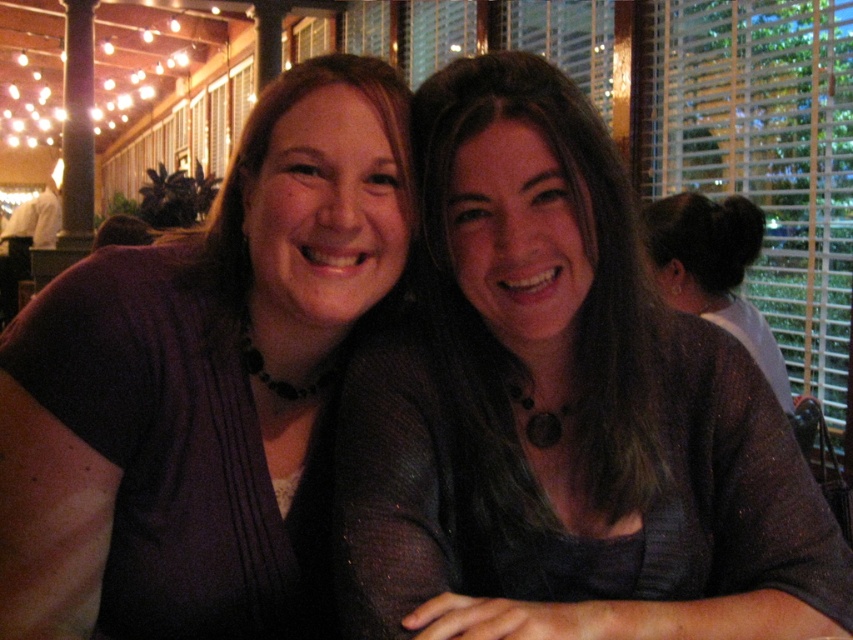
You are a photographer trying to capture a closeup of the purple fabric shirt at center and the matte gray sweater at center. Which one is positioned lower in the frame?

The matte gray sweater at center is positioned lower in the frame than the purple fabric shirt at center.

You are a photographer trying to capture a closeup of the purple fabric shirt at center and the matte gray sweater at center. Which one is located to the left of the other?

The purple fabric shirt at center is located to the left of the matte gray sweater at center because the matte gray sweater at center is positioned on the right side of the purple fabric shirt at center.